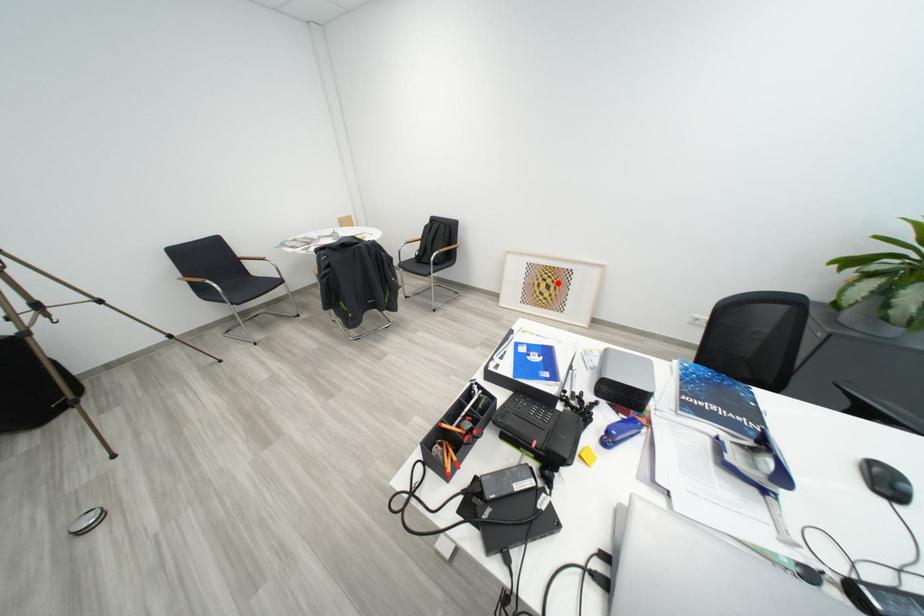
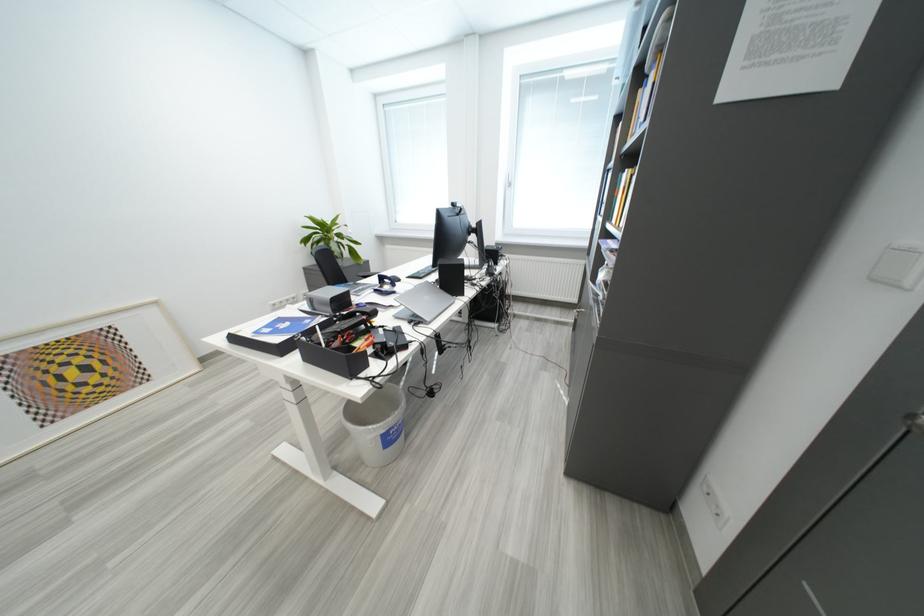
Question: I am providing you with two images of the same scene from different viewpoints. Image1 has a red point marked. In image2, the corresponding 3D location appears at what relative position? Reply with the corresponding letter.

Choices:
 (A) Closer
 (B) Farther

Answer: (B)